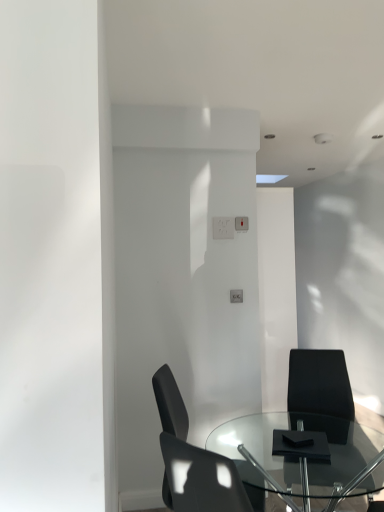
Question: In terms of height, does matte black chair at lower center, which is the 2th chair in right-to-left order, look taller or shorter compared to transparent glass table at center?

Choices:
 (A) short
 (B) tall

Answer: (B)

Question: Visually, is matte black chair at lower center, which is the 2th chair in right-to-left order, positioned to the left or to the right of transparent glass table at center?

Choices:
 (A) right
 (B) left

Answer: (B)

Question: Which object is positioned farthest from the transparent glass table at center?

Choices:
 (A) matte black chair at lower center, arranged as the 1th chair when viewed from the left
 (B) black matte chair at lower right, placed as the 2th chair when sorted from left to right

Answer: (A)

Question: Which of these objects is positioned closest to the transparent glass table at center?

Choices:
 (A) black matte chair at lower right, acting as the first chair starting from the right
 (B) matte black chair at lower center, which is the 2th chair in right-to-left order

Answer: (A)